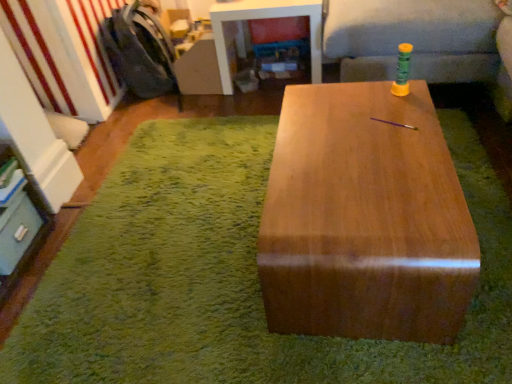
At what (x,y) coordinates should I click in order to perform the action: click on free space above satin wood table at center, marked as the second table in a back-to-front arrangement (from a real-world perspective). Please return your answer as a coordinate pair (x, y). Looking at the image, I should click on [362, 149].